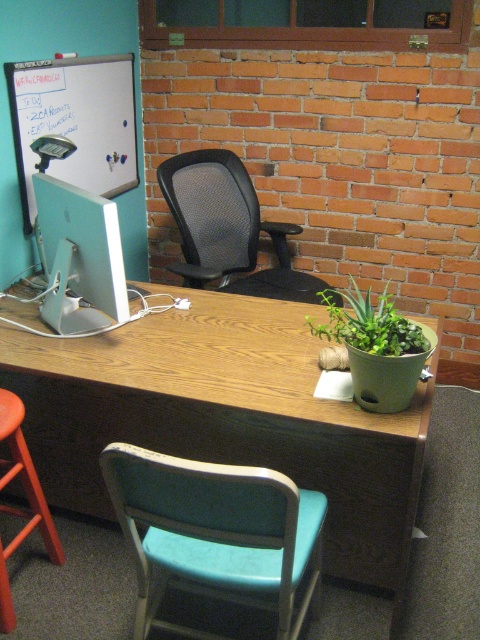
You are sitting in the teal fabric chair at lower center and want to reach the green matte plant at right to water it. Can you easily access the plant without moving the chair?

The teal fabric chair at lower center is in front of the green matte plant at right, so you can easily access the plant without moving the chair because it is positioned directly in front of you.

You are sitting in the teal fabric chair at lower center and want to reach the green matte plant at right to water it. Based on the scene description, can you easily reach the plant without moving from your current position?

The teal fabric chair at lower center is located below the green matte plant at right, so the plant is positioned higher up. Since you are sitting in the chair, you might need to stretch upwards to reach the plant, but it should be possible without moving from your current position.